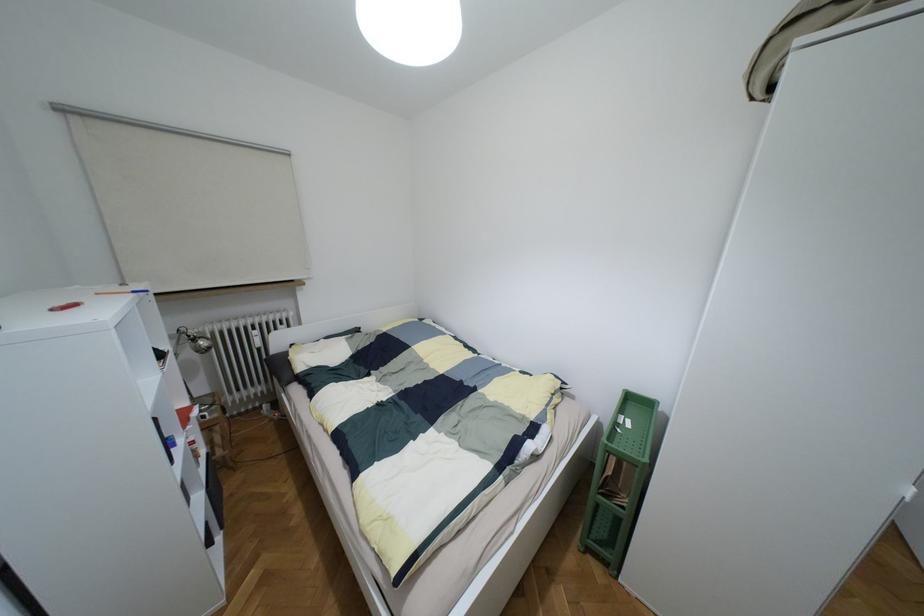
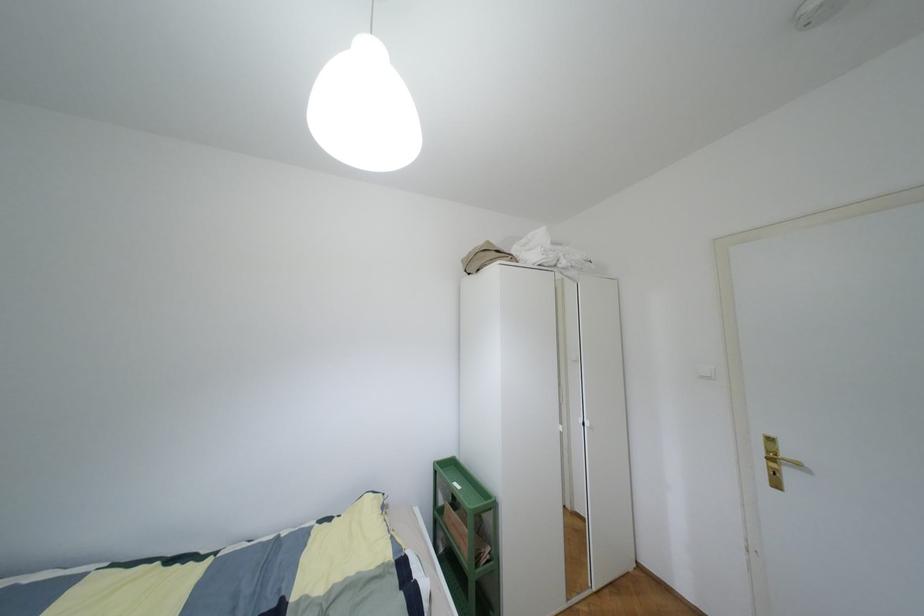
Question: The images are taken continuously from a first-person perspective. In which direction is your viewpoint rotating?

Choices:
 (A) Left
 (B) Right
 (C) Up
 (D) Down

Answer: (B)